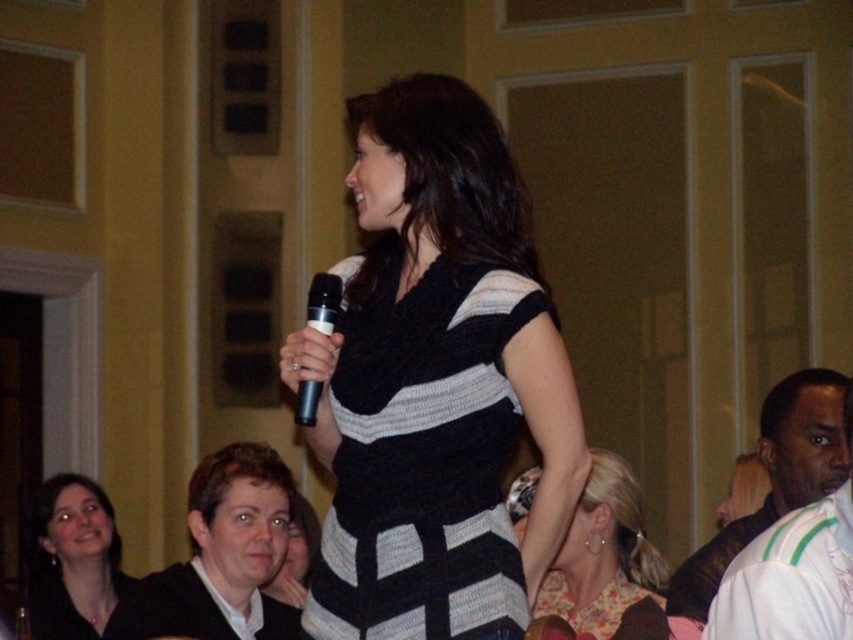
You are an event photographer at the speaking event. You need to take a photo that includes both the black knitted dress at center and the matte black sweater at lower left. Based on their positions, which object should you focus on first to ensure both are in the frame?

The black knitted dress at center is to the right of the matte black sweater at lower left. To include both in the frame, focus on the matte black sweater at lower left first, then adjust the camera to include the black knitted dress at center to the right of it.